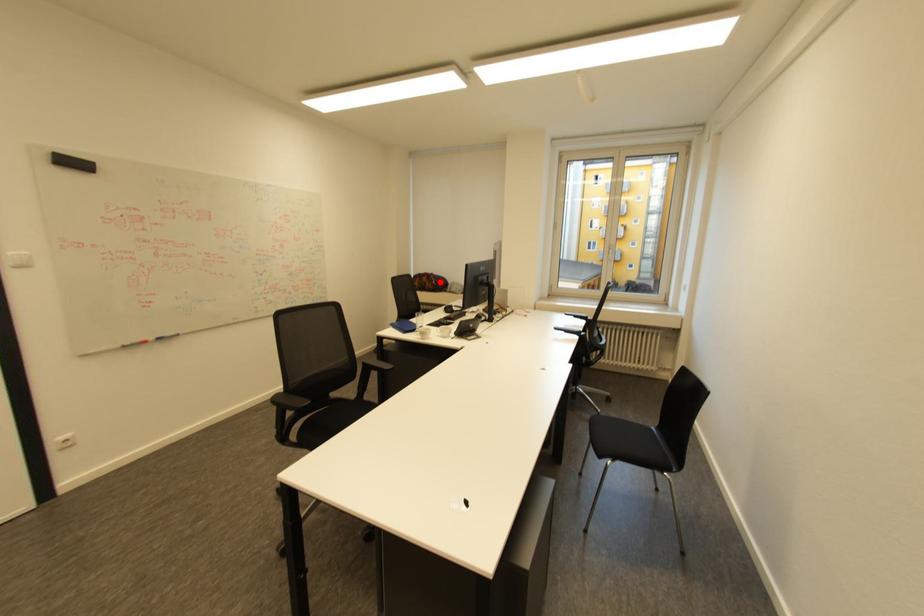
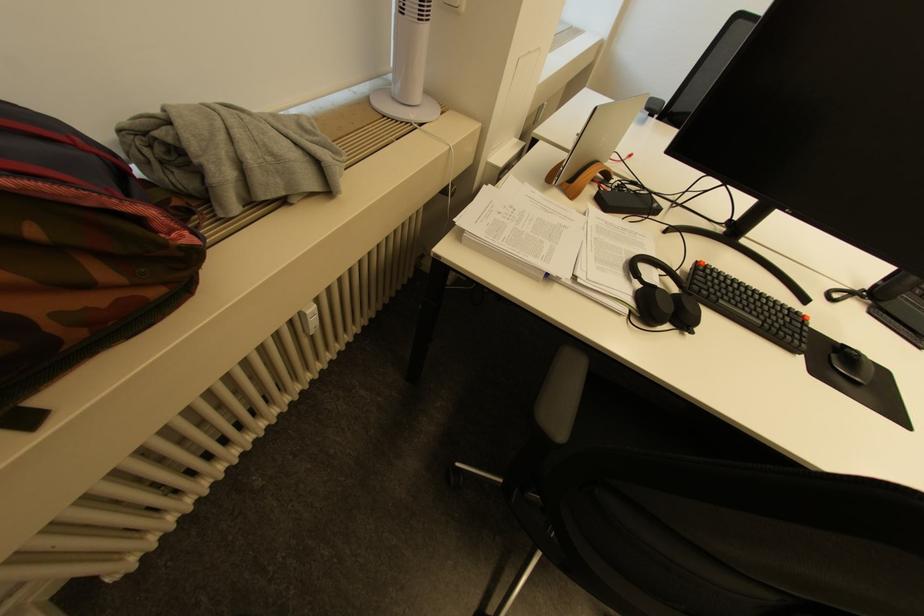
The point at the highlighted location is marked in the first image. Where is the corresponding point in the second image?

(196, 238)